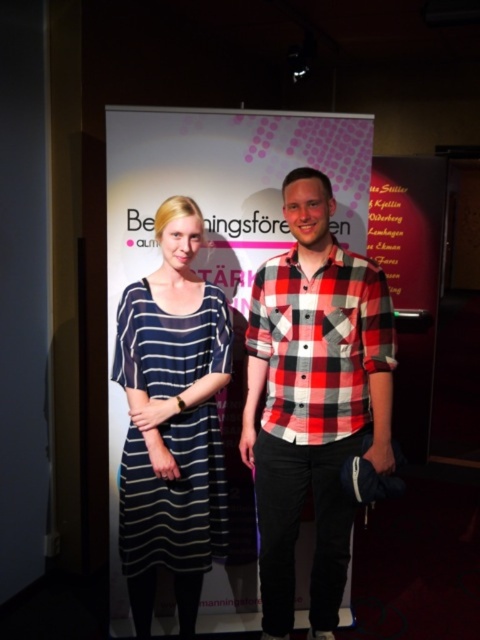
Question: Does red plaid shirt at center appear over navy striped dress at center?

Choices:
 (A) no
 (B) yes

Answer: (B)

Question: Considering the real-world distances, which object is closest to the red checkered shirt at center?

Choices:
 (A) navy striped dress at center
 (B) red plaid shirt at center

Answer: (B)

Question: Can you confirm if navy striped dress at center is positioned to the right of red checkered shirt at center?

Choices:
 (A) no
 (B) yes

Answer: (A)

Question: Which point is closer to the camera taking this photo?

Choices:
 (A) (339, 364)
 (B) (288, 593)
 (C) (192, 384)

Answer: (A)

Question: Can you confirm if red plaid shirt at center is wider than red checkered shirt at center?

Choices:
 (A) no
 (B) yes

Answer: (B)

Question: Which of the following is the farthest from the observer?

Choices:
 (A) (264, 344)
 (B) (203, 540)

Answer: (A)